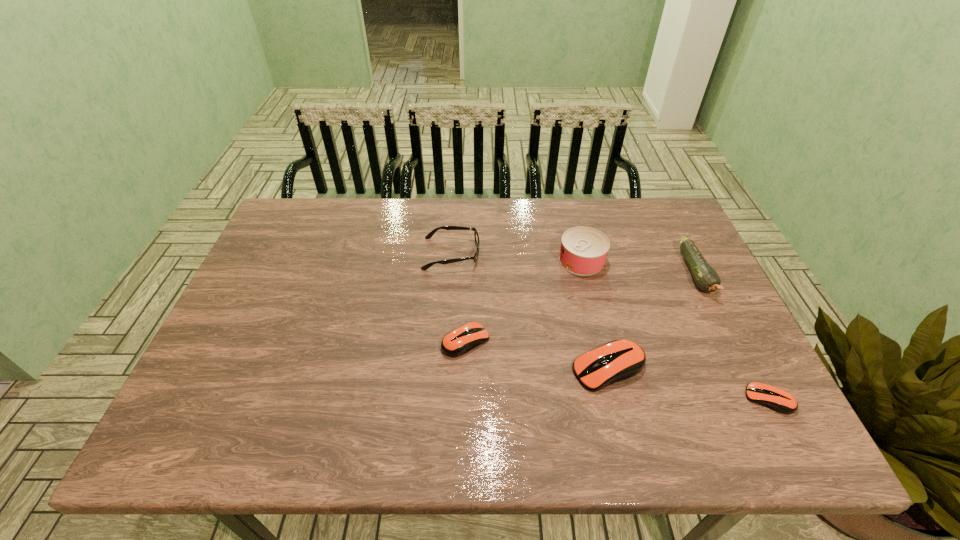
The image size is (960, 540). Identify the location of vacant space that satisfies the following two spatial constraints: 1. on the front-facing side of the spectacles; 2. on the back side of the rightmost computer mouse. (442, 400).

I want to click on free space that satisfies the following two spatial constraints: 1. on the front-facing side of the can; 2. on the right side of the spectacles, so click(x=451, y=260).